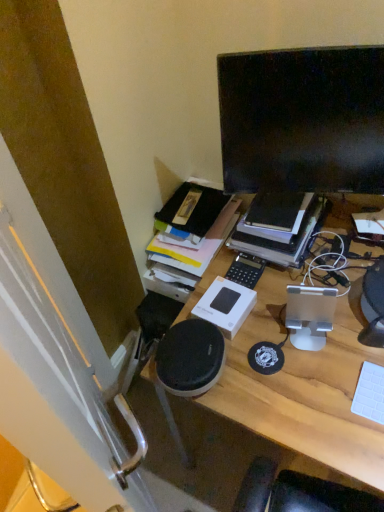
At what (x,y) coordinates should I click in order to perform the action: click on free space above wooden desk at center (from a real-world perspective). Please return your answer as a coordinate pair (x, y). The image size is (384, 512). Looking at the image, I should click on (339, 326).